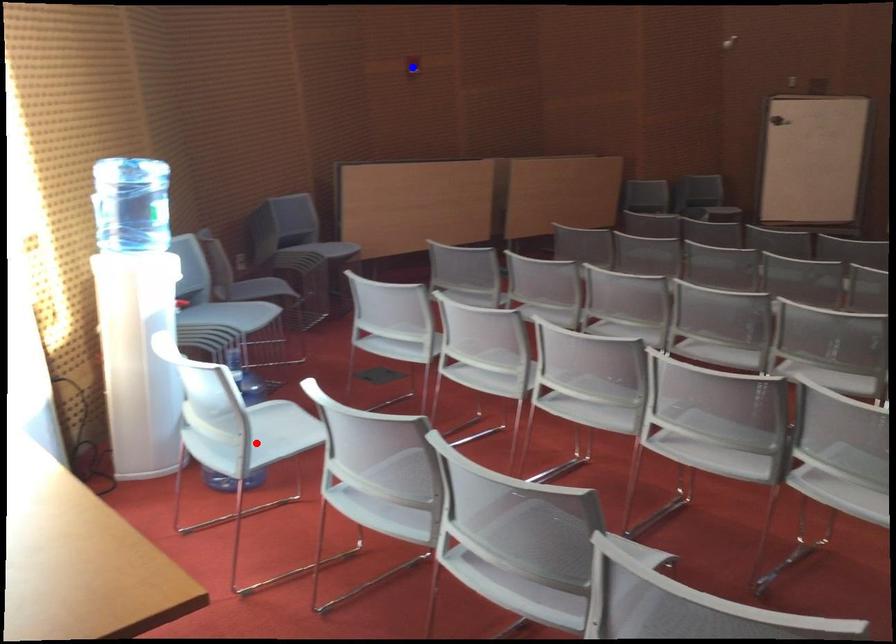
Question: In the image, two points are highlighted. Which point is nearer to the camera? Reply with the corresponding letter.

Choices:
 (A) blue point
 (B) red point

Answer: (B)